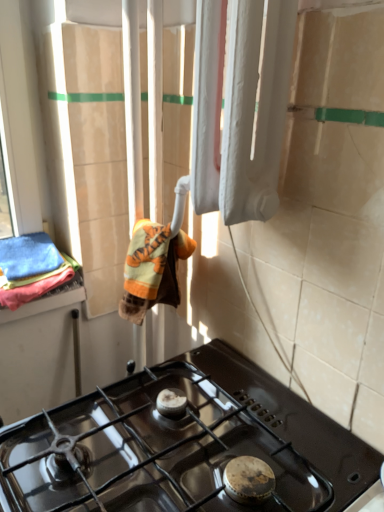
Question: Is orange plush bath towel at center, acting as the second bath towel starting from the left, taller than black glass gas stove at lower center?

Choices:
 (A) no
 (B) yes

Answer: (B)

Question: From a real-world perspective, is orange plush bath towel at center, acting as the second bath towel starting from the left, physically above black glass gas stove at lower center?

Choices:
 (A) no
 (B) yes

Answer: (B)

Question: Is orange plush bath towel at center, acting as the second bath towel starting from the left, smaller than black glass gas stove at lower center?

Choices:
 (A) yes
 (B) no

Answer: (A)

Question: Considering the relative positions of orange plush bath towel at center, which appears as the 1th bath towel when viewed from the right, and black glass gas stove at lower center in the image provided, is orange plush bath towel at center, which appears as the 1th bath towel when viewed from the right, to the left of black glass gas stove at lower center from the viewer's perspective?

Choices:
 (A) no
 (B) yes

Answer: (B)

Question: Is orange plush bath towel at center, which appears as the 1th bath towel when viewed from the right, not within black glass gas stove at lower center?

Choices:
 (A) no
 (B) yes

Answer: (B)

Question: Does orange plush bath towel at center, which appears as the 1th bath towel when viewed from the right, lie behind black glass gas stove at lower center?

Choices:
 (A) yes
 (B) no

Answer: (A)

Question: Is soft cotton towels at left, marked as the first bath towel in a left-to-right arrangement, not inside black glass gas stove at lower center?

Choices:
 (A) no
 (B) yes

Answer: (B)

Question: Is soft cotton towels at left, the 2th bath towel from the right, not close to black glass gas stove at lower center?

Choices:
 (A) yes
 (B) no

Answer: (B)

Question: Could you tell me if soft cotton towels at left, the 2th bath towel from the right, is facing black glass gas stove at lower center?

Choices:
 (A) yes
 (B) no

Answer: (A)

Question: Is soft cotton towels at left, the 2th bath towel from the right, positioned with its back to black glass gas stove at lower center?

Choices:
 (A) yes
 (B) no

Answer: (B)

Question: Is black glass gas stove at lower center a part of soft cotton towels at left, the 2th bath towel from the right?

Choices:
 (A) no
 (B) yes

Answer: (A)

Question: From a real-world perspective, is soft cotton towels at left, the 2th bath towel from the right, under black glass gas stove at lower center?

Choices:
 (A) no
 (B) yes

Answer: (A)

Question: From the image's perspective, does orange plush bath towel at center, which appears as the 1th bath towel when viewed from the right, appear higher than soft cotton towels at left, marked as the first bath towel in a left-to-right arrangement?

Choices:
 (A) yes
 (B) no

Answer: (B)